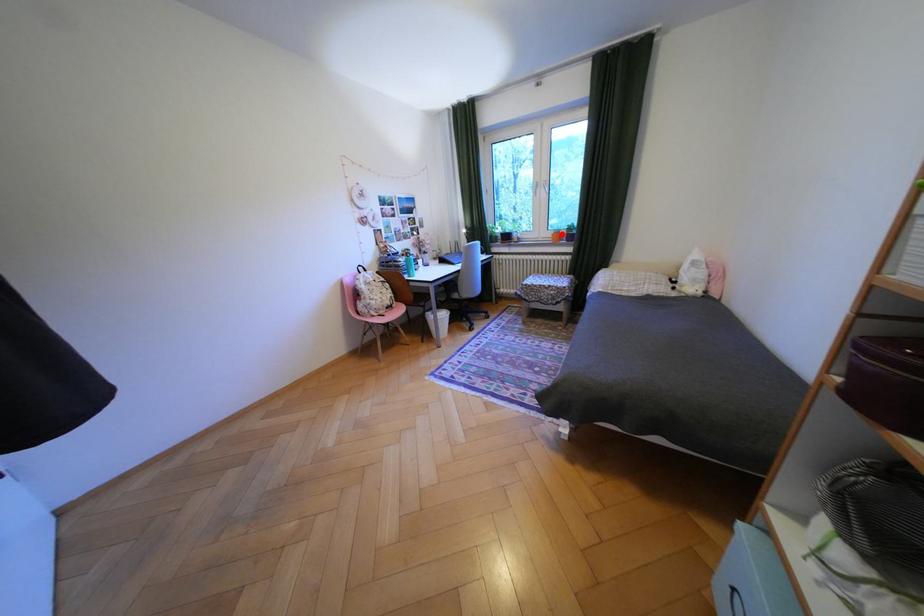
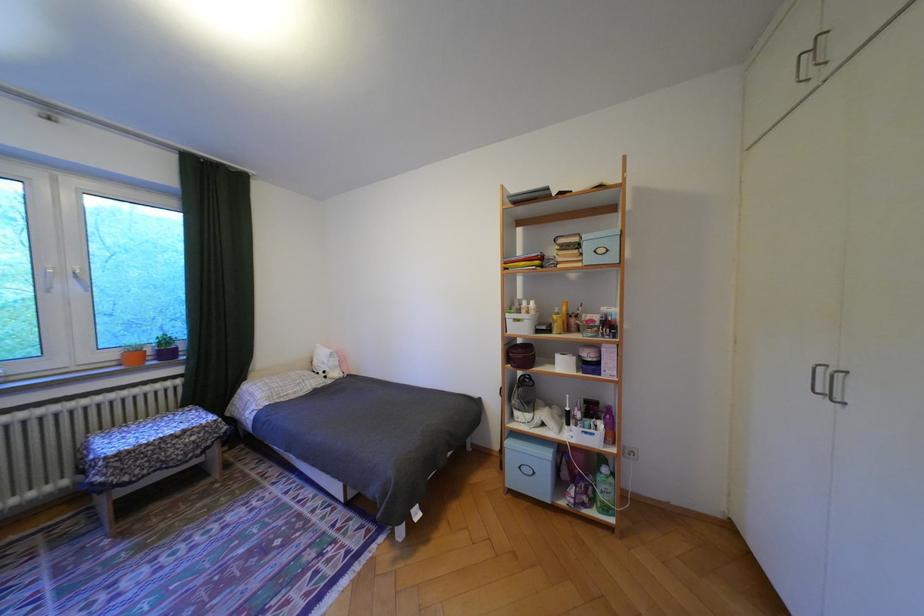
Locate, in the second image, the point that corresponds to the highlighted location in the first image.

(124, 355)